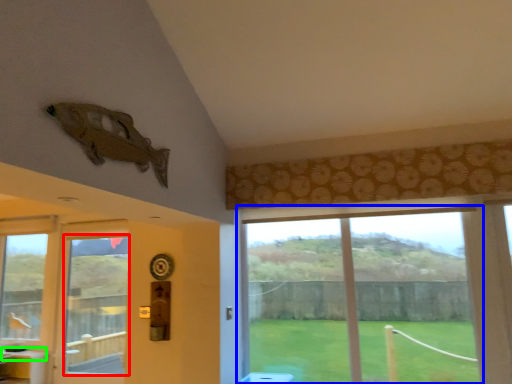
Question: Estimate the real-world distances between objects in this image. Which object is farther from window screen (highlighted by a red box), window (highlighted by a blue box) or counter top (highlighted by a green box)?

Choices:
 (A) window
 (B) counter top

Answer: (A)